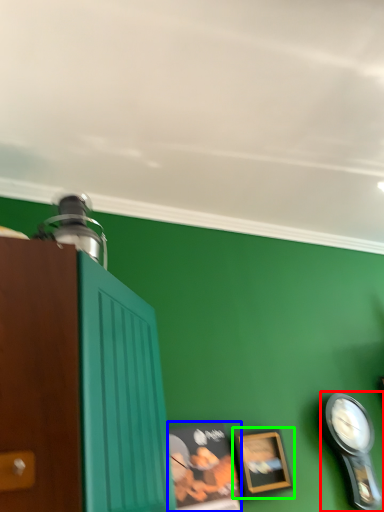
Question: Which is nearer to the clock (highlighted by a red box)? picture frame (highlighted by a blue box) or picture frame (highlighted by a green box).

Choices:
 (A) picture frame
 (B) picture frame

Answer: (B)